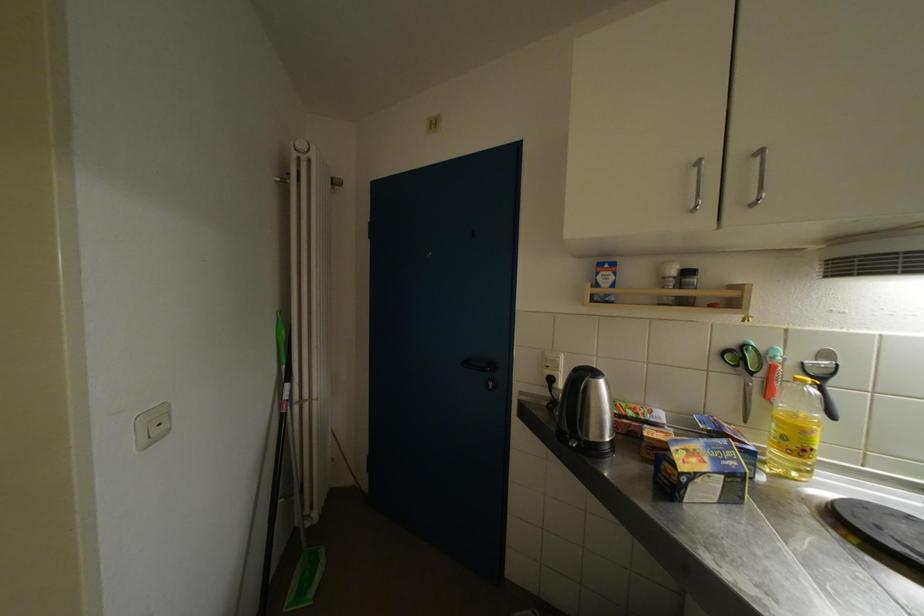
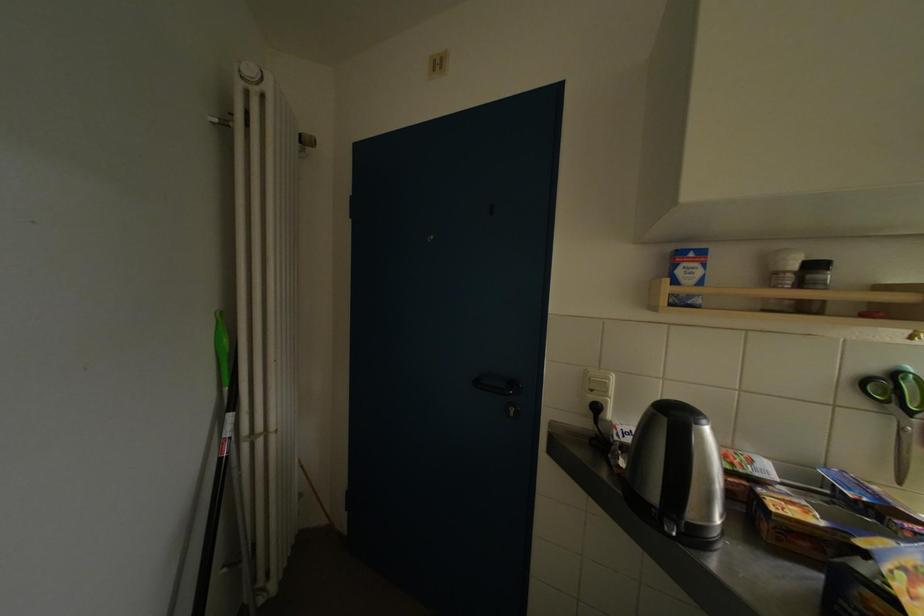
Where in the second image is the point corresponding to pixel 606 282 from the first image?

(686, 276)